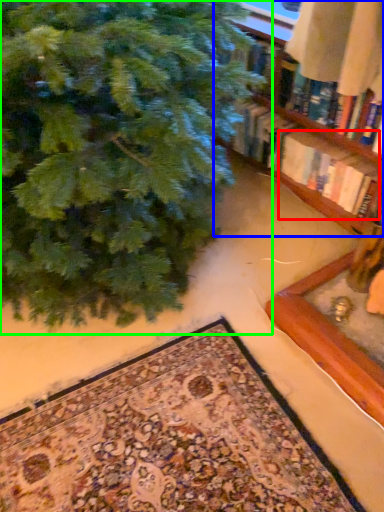
Question: Estimate the real-world distances between objects in this image. Which object is farther from book (highlighted by a red box), shelf (highlighted by a blue box) or christmas tree (highlighted by a green box)?

Choices:
 (A) shelf
 (B) christmas tree

Answer: (B)